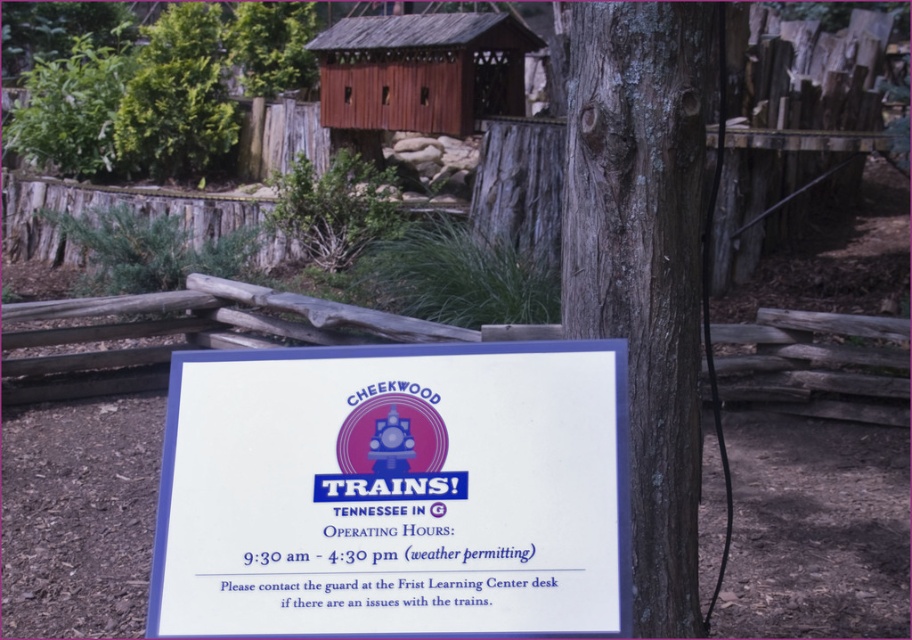
You are a visitor at Cheekwood Trains in Tennessee and you see the white paper sign at center and the gray bark tree trunk at center. Which object is closer to you?

The white paper sign at center is closer to you because it is in front of the gray bark tree trunk at center.

You are a hiker who wants to read the white paper sign at center. Can you easily read it while standing next to the gray bark tree trunk at center?

The white paper sign at center occupies less space than the gray bark tree trunk at center, so it might be difficult to read the sign clearly while standing next to the tree trunk.